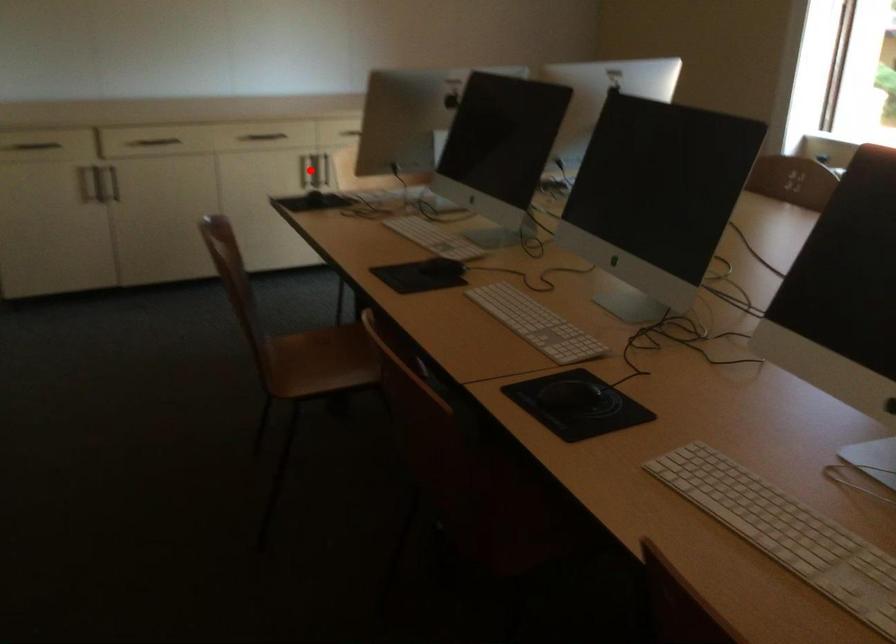
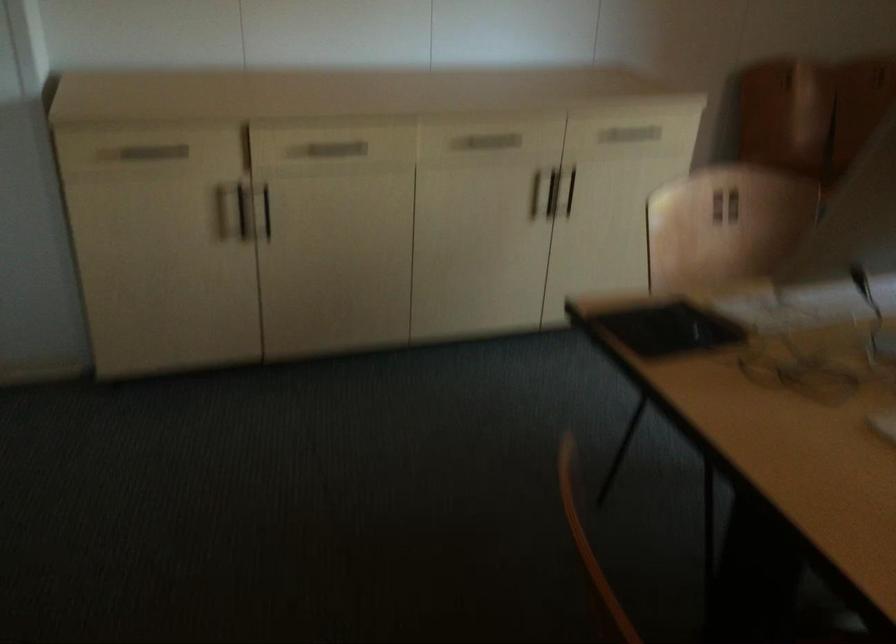
Question: I am providing you with two images of the same scene from different viewpoints. A red point is marked on the first image. Can you still see the location of the red point in image 2?

Choices:
 (A) Yes
 (B) No

Answer: (A)